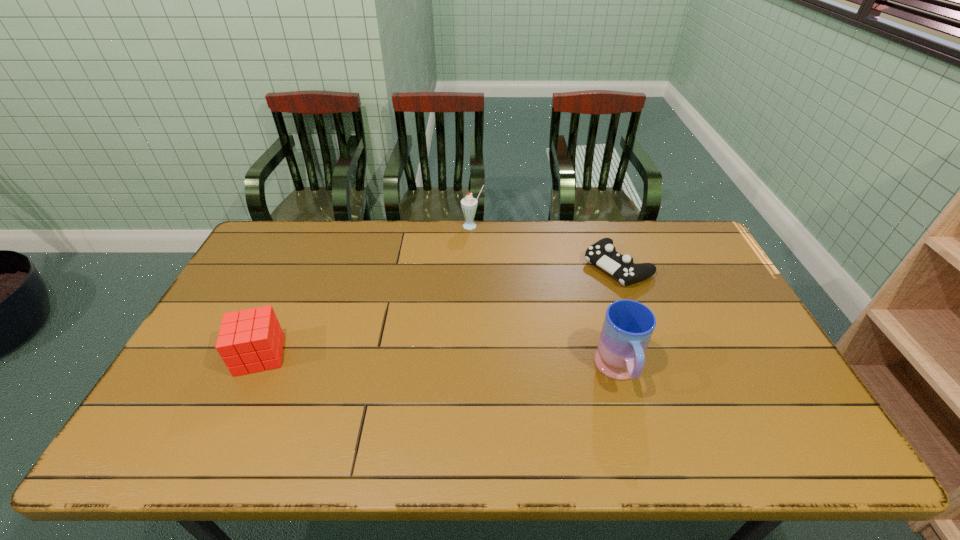
I want to click on free space at the right edge of the desktop, so click(x=723, y=359).

At what (x,y) coordinates should I click in order to perform the action: click on free location at the far left corner of the desktop. Please return your answer as a coordinate pair (x, y). Image resolution: width=960 pixels, height=540 pixels. Looking at the image, I should click on (277, 261).

The width and height of the screenshot is (960, 540). In the image, there is a desktop. What are the coordinates of `vacant space at the far right corner` in the screenshot? It's located at (688, 236).

Find the location of a particular element. The image size is (960, 540). vacant area that lies between the leftmost object and the mug is located at coordinates (440, 363).

Find the location of a particular element. The width and height of the screenshot is (960, 540). free spot between the control and the cube is located at coordinates (439, 310).

You are a GUI agent. You are given a task and a screenshot of the screen. Output one action in this format:
    pyautogui.click(x=<x>, y=<y>)
    Task: Click on the vacant area between the milkshake and the cube
    The image size is (960, 540).
    Given the screenshot: What is the action you would take?
    pyautogui.click(x=366, y=291)

Find the location of a particular element. vacant space in between the third tallest object and the mug is located at coordinates (440, 363).

The image size is (960, 540). Identify the location of vacant region between the control and the second shortest object. (439, 310).

I want to click on vacant space that is in between the farthest object and the leftmost object, so click(366, 291).

The height and width of the screenshot is (540, 960). Identify the location of vacant point located between the leftmost object and the shortest object. (439, 310).